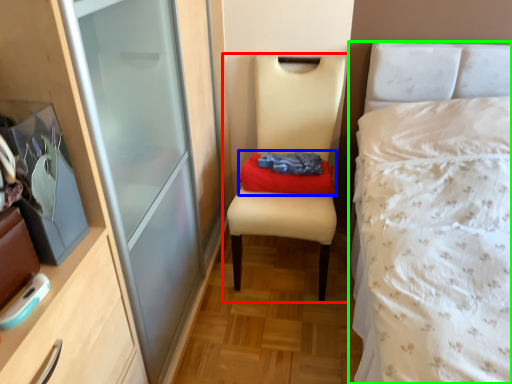
Question: Which is nearer to the chair (highlighted by a red box)? clothing (highlighted by a blue box) or bed (highlighted by a green box).

Choices:
 (A) clothing
 (B) bed

Answer: (A)